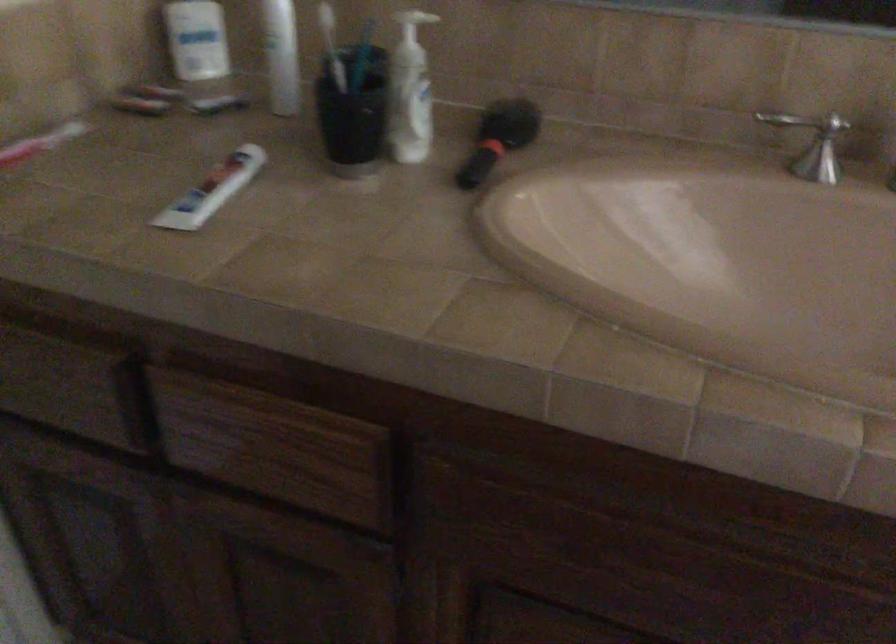
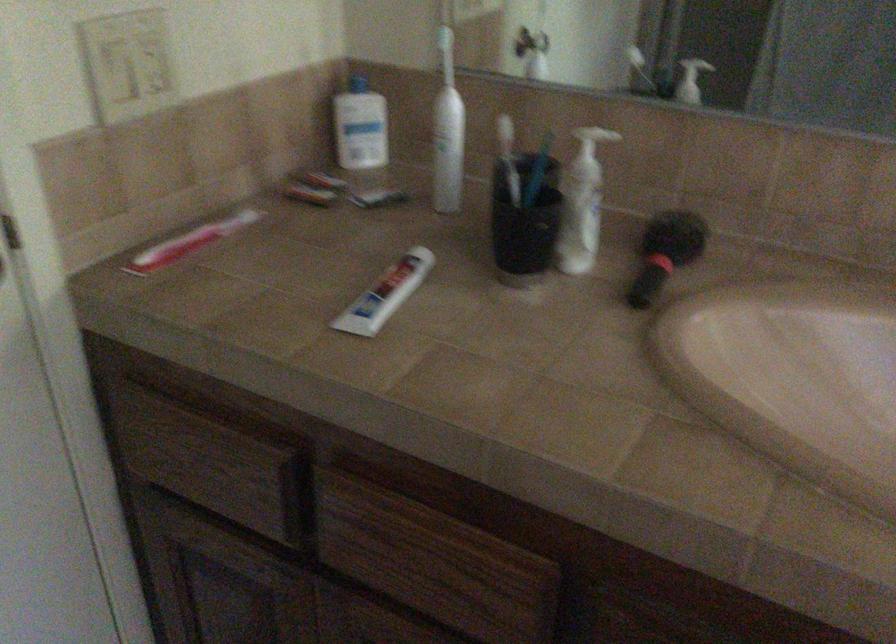
Find the pixel in the second image that matches the point at 496,140 in the first image.

(666, 252)